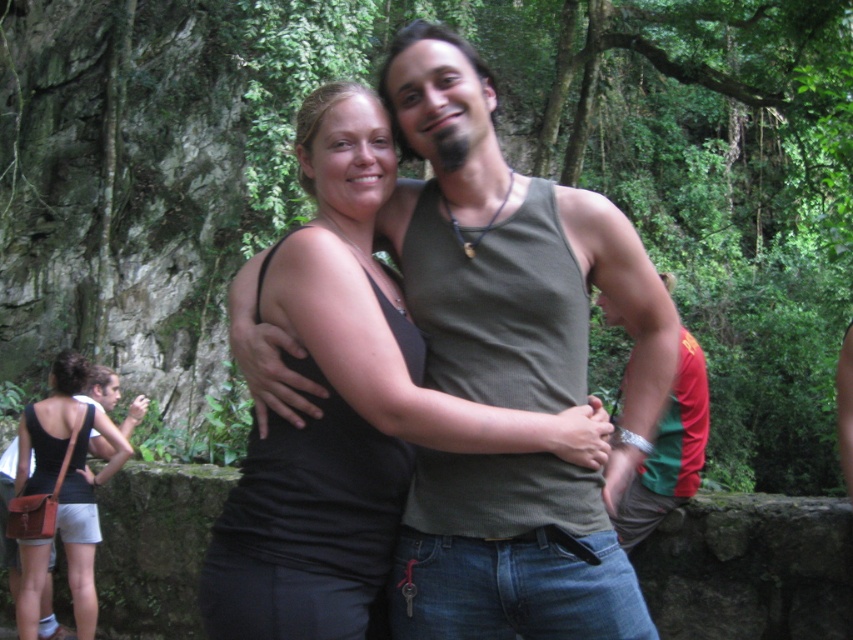
Which is above, matte green tank top at center or green fabric shirt at right?

matte green tank top at center is higher up.

The width and height of the screenshot is (853, 640). Find the location of `matte green tank top at center`. matte green tank top at center is located at coordinates (511, 365).

At what (x,y) coordinates should I click in order to perform the action: click on matte green tank top at center. Please return your answer as a coordinate pair (x, y). This screenshot has height=640, width=853. Looking at the image, I should click on (511, 365).

Who is taller, matte green tank top at center or black fabric tank top at left?

black fabric tank top at left

Does matte green tank top at center have a smaller size compared to black fabric tank top at left?

Actually, matte green tank top at center might be larger than black fabric tank top at left.

Is point (459, 636) farther from viewer compared to point (74, 412)?

No, it is not.

Image resolution: width=853 pixels, height=640 pixels. Identify the location of matte green tank top at center. (511, 365).

How distant is black fabric tank top at left from green fabric shirt at right?

The distance of black fabric tank top at left from green fabric shirt at right is 10.55 feet.

Between point (41, 448) and point (656, 449), which one is positioned behind?

Positioned behind is point (41, 448).

You are a GUI agent. You are given a task and a screenshot of the screen. Output one action in this format:
    pyautogui.click(x=<x>, y=<y>)
    Task: Click on the black fabric tank top at left
    This screenshot has height=640, width=853.
    Given the screenshot: What is the action you would take?
    pyautogui.click(x=68, y=474)